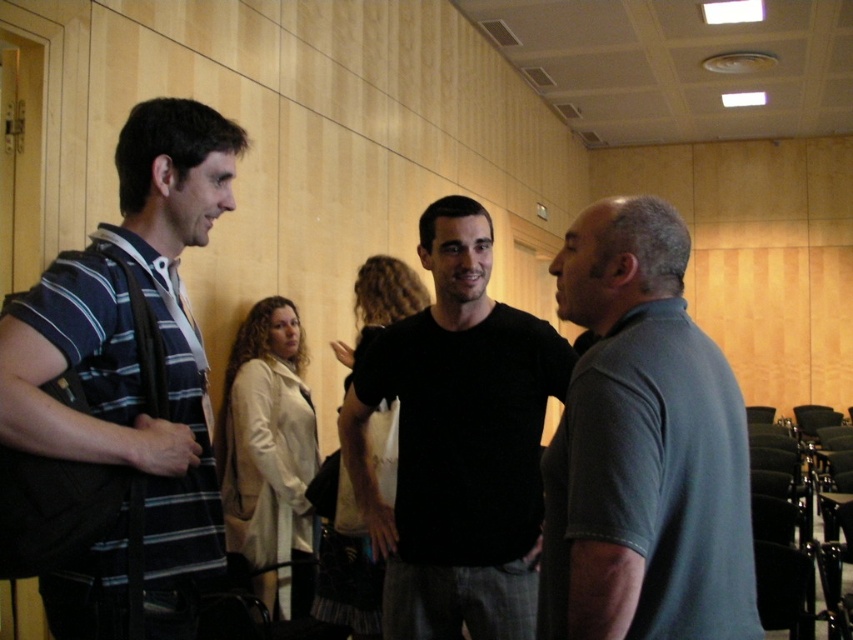
Question: Which object is positioned farthest from the striped cotton shirt at left?

Choices:
 (A) gray cotton polo shirt at right
 (B) black matte shirt at center

Answer: (B)

Question: Where is gray cotton polo shirt at right located in relation to striped cotton shirt at left in the image?

Choices:
 (A) left
 (B) right

Answer: (B)

Question: Considering the real-world distances, which object is farthest from the black matte shirt at center?

Choices:
 (A) striped cotton shirt at left
 (B) gray cotton polo shirt at right

Answer: (A)

Question: Is gray cotton polo shirt at right above striped cotton shirt at left?

Choices:
 (A) no
 (B) yes

Answer: (A)

Question: Is gray cotton polo shirt at right wider than striped cotton shirt at left?

Choices:
 (A) yes
 (B) no

Answer: (A)

Question: Which point is closer to the camera?

Choices:
 (A) black matte shirt at center
 (B) striped cotton shirt at left
 (C) gray cotton polo shirt at right

Answer: (C)